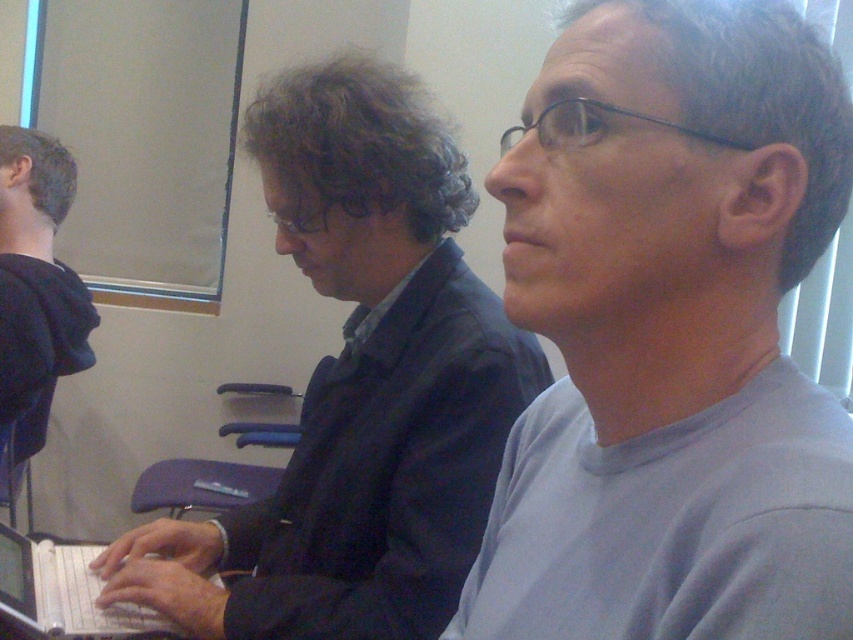
You are an interior designer assessing the seating arrangement for a presentation. You notice the gray matte shirt at center and the dark blue hoodie at left. Which of these two items is shorter in height?

The gray matte shirt at center is not as tall as the dark blue hoodie at left, so the gray matte shirt at center is shorter in height.